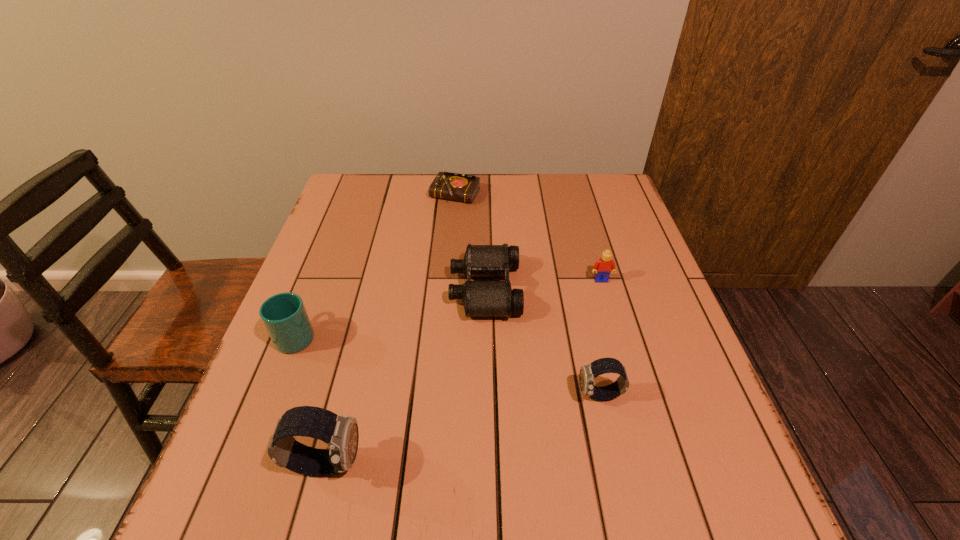
Where is `free region located 0.140m on the front-facing side of the Lego`? This screenshot has height=540, width=960. free region located 0.140m on the front-facing side of the Lego is located at coordinates (614, 326).

Where is `object at the far edge`? object at the far edge is located at coordinates (452, 186).

Where is `object present at the near edge`? object present at the near edge is located at coordinates (341, 434).

You are a GUI agent. You are given a task and a screenshot of the screen. Output one action in this format:
    pyautogui.click(x=<x>, y=<y>)
    Task: Click on the watch that is at the left edge
    This screenshot has height=540, width=960.
    Given the screenshot: What is the action you would take?
    pyautogui.click(x=341, y=434)

Identify the location of cup located in the left edge section of the desktop. This screenshot has width=960, height=540. (284, 316).

Identify the location of object present at the right edge. (604, 266).

Where is `object located in the near left corner section of the desktop`? object located in the near left corner section of the desktop is located at coordinates (341, 434).

Where is `vacant area at the far edge of the desktop`? vacant area at the far edge of the desktop is located at coordinates (486, 209).

I want to click on vacant area at the near edge, so click(x=522, y=449).

Identify the location of vacant space at the left edge. The width and height of the screenshot is (960, 540). (338, 332).